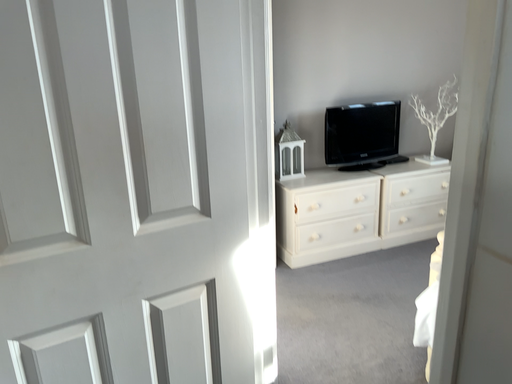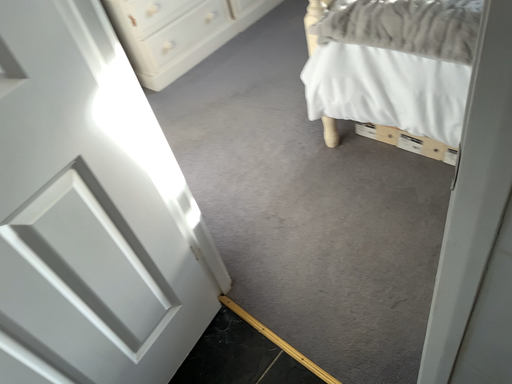
Question: How did the camera likely rotate when shooting the video?

Choices:
 (A) rotated right
 (B) rotated left

Answer: (A)